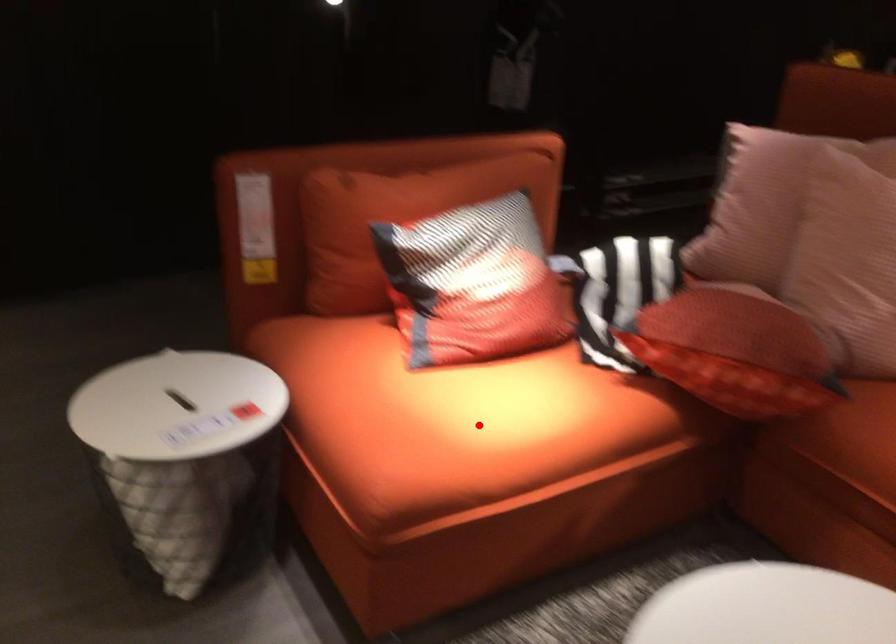
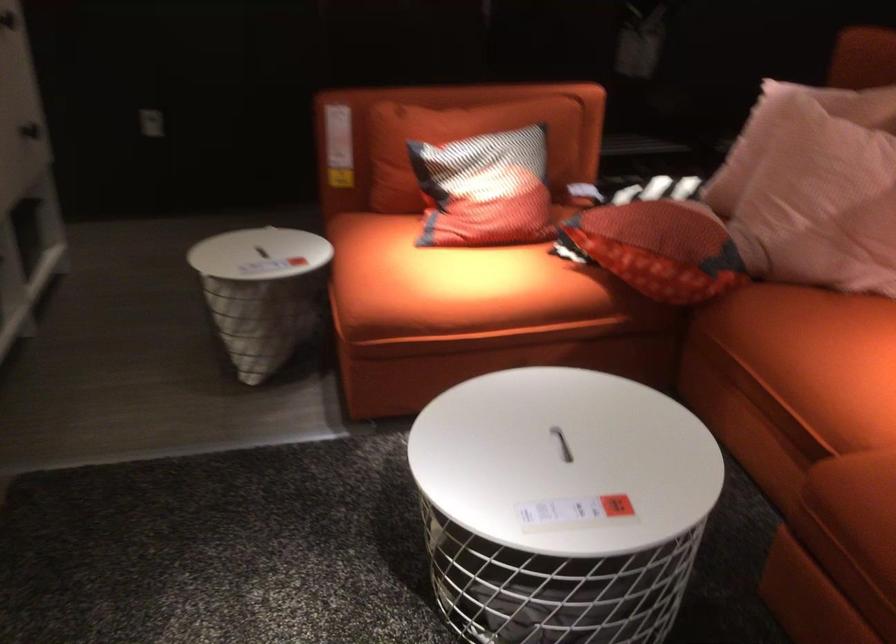
Question: A red point is marked in image1. In image2, is the corresponding 3D point closer to the camera or farther? Reply with the corresponding letter.

Choices:
 (A) The corresponding 3D point is closer.
 (B) The corresponding 3D point is farther.

Answer: (B)